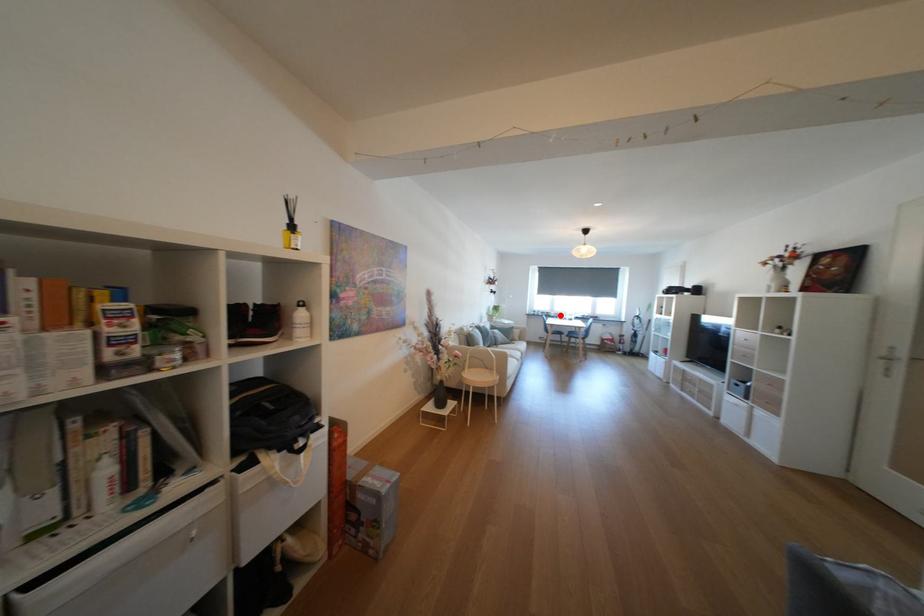
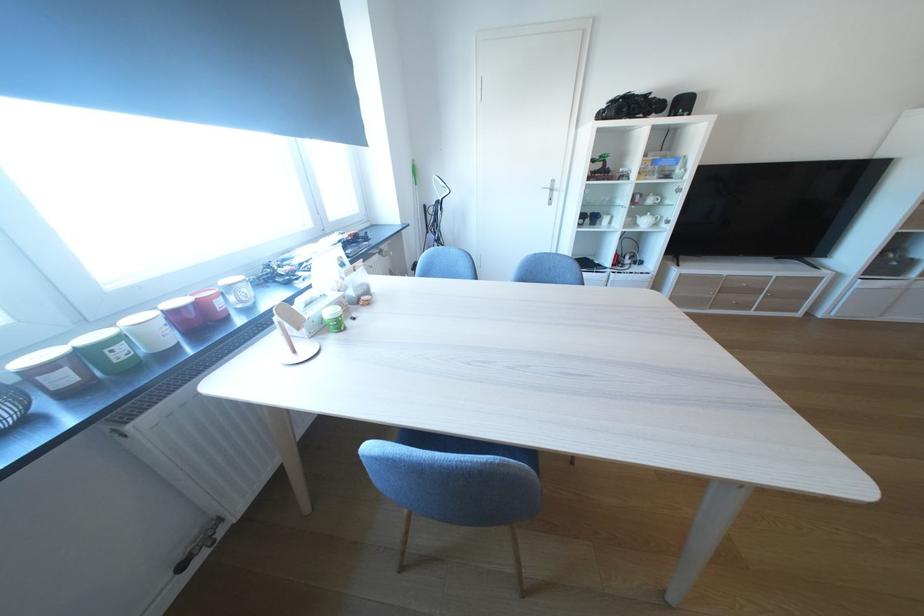
In the second image, find the point that corresponds to the highlighted location in the first image.

(129, 354)